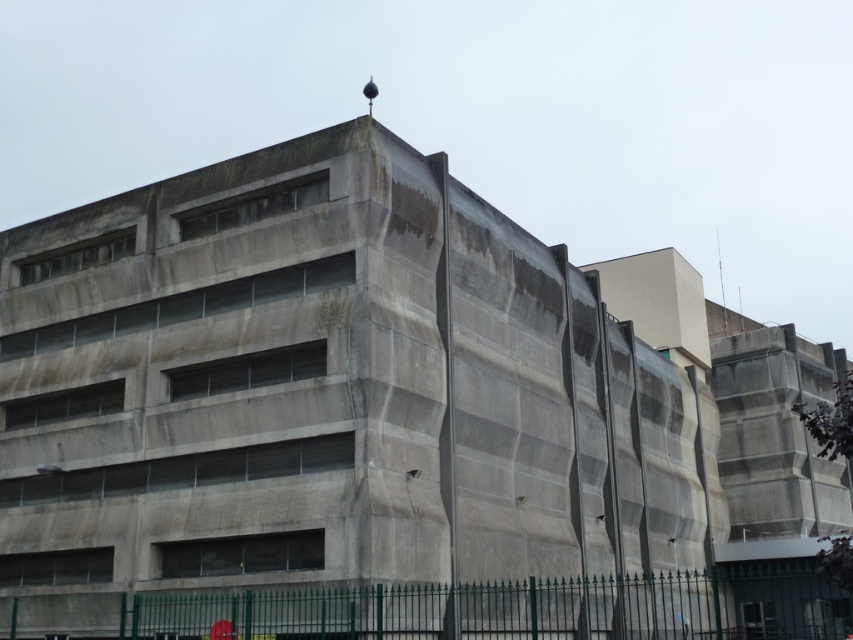
Which of these two, gray concrete building at center or green wrought iron fence at lower center, stands shorter?

Standing shorter between the two is green wrought iron fence at lower center.

Which is in front, point (186, 212) or point (798, 586)?

Point (186, 212) is in front.

Identify the location of gray concrete building at center. (329, 388).